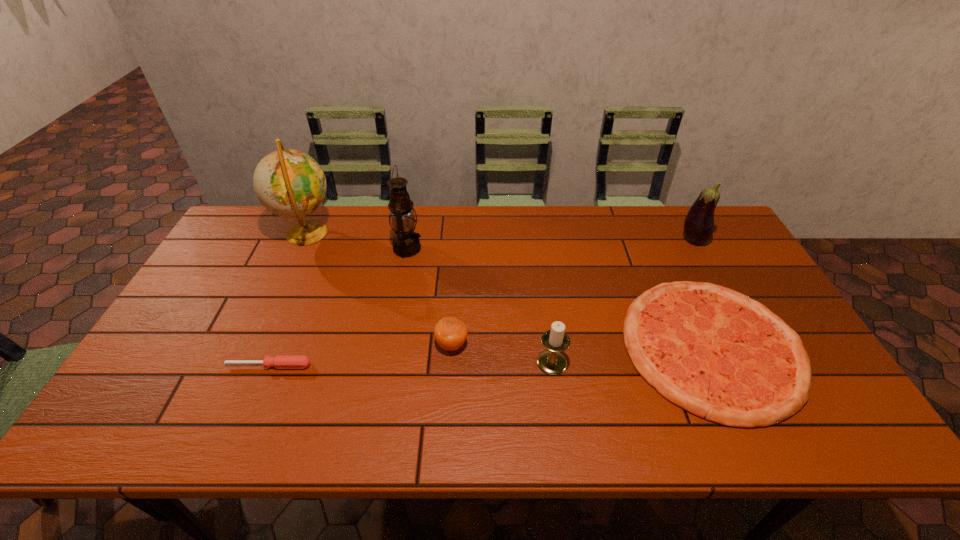
This screenshot has height=540, width=960. Find the location of `object that is at the left edge`. object that is at the left edge is located at coordinates (x=289, y=183).

This screenshot has height=540, width=960. In order to click on eggplant located in the right edge section of the desktop in this screenshot , I will do `click(699, 223)`.

Where is `pizza located in the right edge section of the desktop`? The height and width of the screenshot is (540, 960). pizza located in the right edge section of the desktop is located at coordinates (718, 354).

Image resolution: width=960 pixels, height=540 pixels. I want to click on object located in the far left corner section of the desktop, so click(289, 183).

Locate an element on the screen. The height and width of the screenshot is (540, 960). object present at the far right corner is located at coordinates (699, 223).

At what (x,y) coordinates should I click in order to perform the action: click on object that is positioned at the near right corner. Please return your answer as a coordinate pair (x, y). Image resolution: width=960 pixels, height=540 pixels. Looking at the image, I should click on (718, 354).

This screenshot has height=540, width=960. I want to click on free space at the far edge, so click(x=659, y=234).

Locate an element on the screen. The height and width of the screenshot is (540, 960). vacant space at the near edge is located at coordinates (594, 415).

Find the location of a particular element. This screenshot has height=540, width=960. vacant region at the left edge of the desktop is located at coordinates (244, 295).

What are the coordinates of `free space at the right edge of the desktop` in the screenshot? It's located at (761, 281).